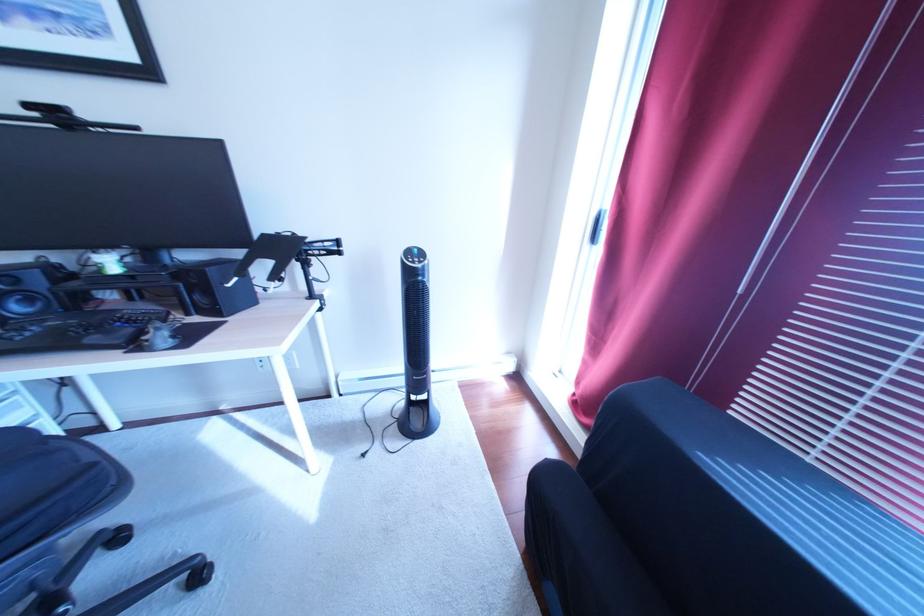
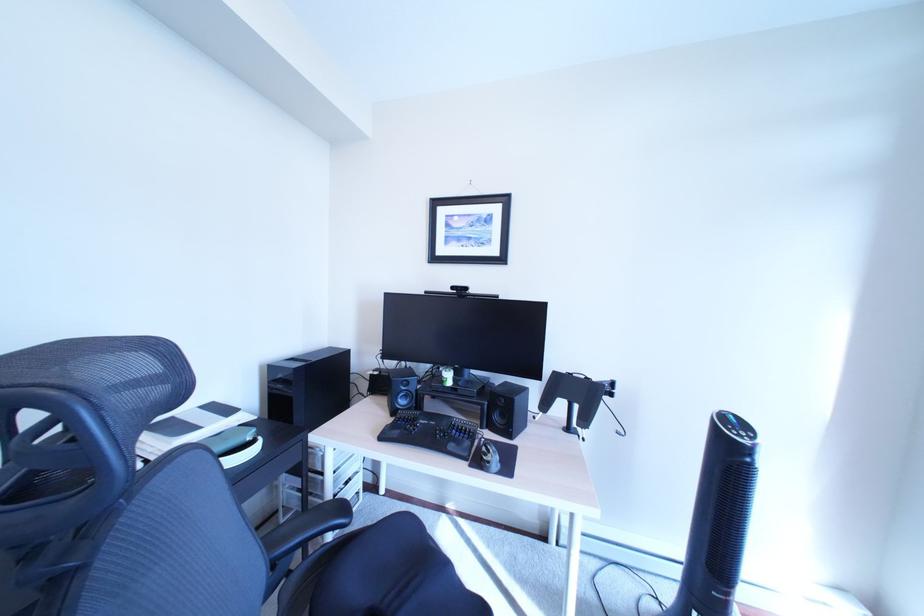
First-person continuous shooting, in which direction is the camera rotating?

The camera rotated toward left-up.